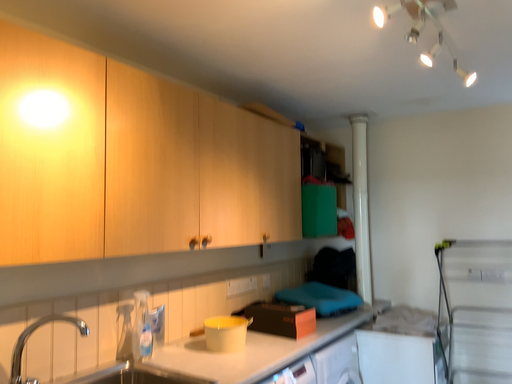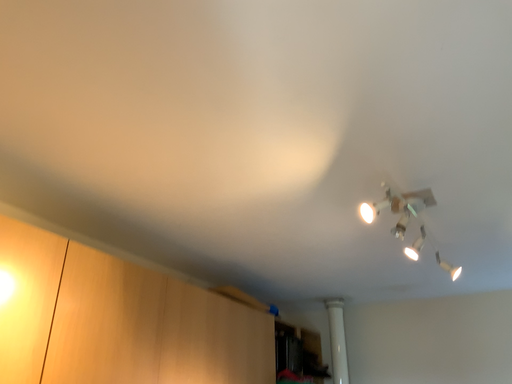
Question: How did the camera likely rotate when shooting the video?

Choices:
 (A) rotated upward
 (B) rotated downward

Answer: (A)